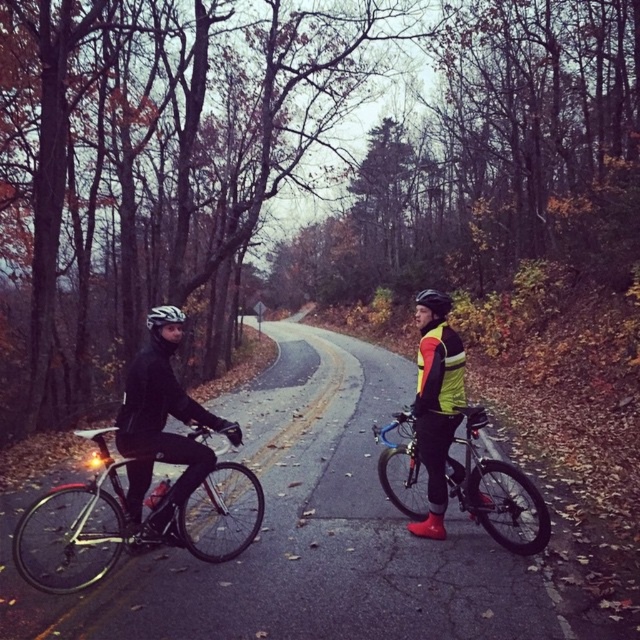
Is shiny black bicycle at left closer to camera compared to matte black bicycle at left?

Yes, shiny black bicycle at left is in front of matte black bicycle at left.

Is shiny black bicycle at left bigger than matte black bicycle at left?

Yes, shiny black bicycle at left is bigger than matte black bicycle at left.

Who is more distant from viewer, (198, 436) or (132, 528)?

The point (198, 436) is behind.

Where is `shiny black bicycle at left`? shiny black bicycle at left is located at coordinates (77, 529).

Is yellow reflective safety vest at center taller than black matte helmet at center?

In fact, yellow reflective safety vest at center may be shorter than black matte helmet at center.

Which of these two, yellow reflective safety vest at center or black matte helmet at center, stands taller?

black matte helmet at center

Who is more distant from viewer, (435, 403) or (417, 304)?

The point (417, 304) is more distant.

Locate an element on the screen. yellow reflective safety vest at center is located at coordinates (440, 371).

Is shiny black bicycle at left shorter than black matte helmet at center?

Yes, shiny black bicycle at left is shorter than black matte helmet at center.

Describe the element at coordinates (77, 529) in the screenshot. I see `shiny black bicycle at left` at that location.

Identify the location of shiny black bicycle at left. This screenshot has height=640, width=640. (77, 529).